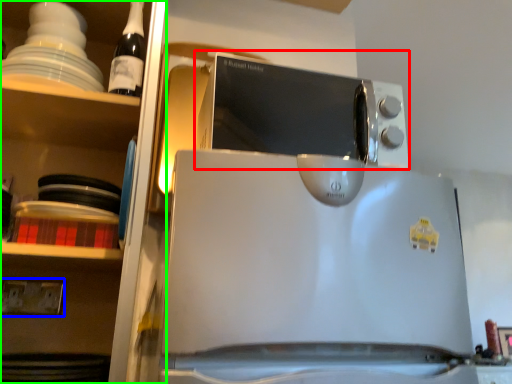
Question: Considering the real-world distances, which object is closest to microwave oven (highlighted by a red box)? electric outlet (highlighted by a blue box) or shelf (highlighted by a green box).

Choices:
 (A) electric outlet
 (B) shelf

Answer: (B)